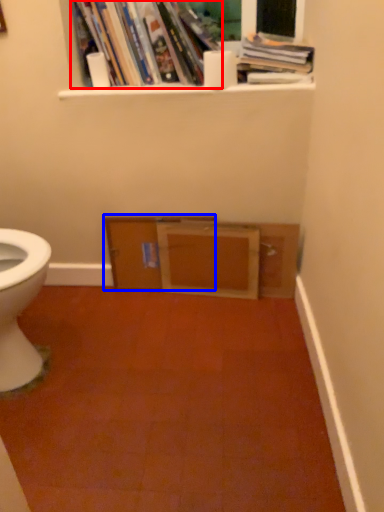
Question: Which of the following is the closest to the observer, book (highlighted by a red box) or file cabinet (highlighted by a blue box)?

Choices:
 (A) book
 (B) file cabinet

Answer: (A)